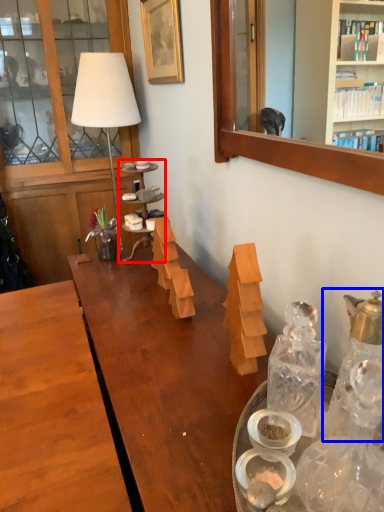
Question: Which object is further to the camera taking this photo, shelf (highlighted by a red box) or bottle (highlighted by a blue box)?

Choices:
 (A) shelf
 (B) bottle

Answer: (A)